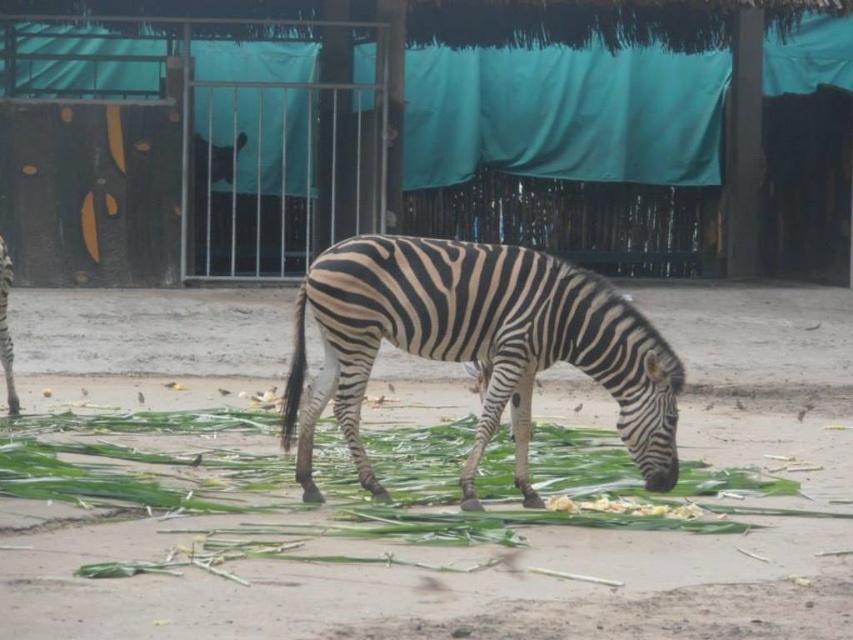
Question: Is green leafy grass at center smaller than black and white striped zebra at center?

Choices:
 (A) yes
 (B) no

Answer: (A)

Question: Which point is farther to the camera?

Choices:
 (A) (695, 477)
 (B) (375, 285)
 (C) (676, 509)

Answer: (A)

Question: Among these objects, which one is farthest from the camera?

Choices:
 (A) yellow crumbly food at lower center
 (B) green leafy grass at center
 (C) black and white striped zebra at center

Answer: (A)

Question: Based on their relative distances, which object is nearer to the green leafy grass at center?

Choices:
 (A) black and white striped zebra at center
 (B) yellow crumbly food at lower center

Answer: (A)

Question: Does black and white striped zebra at center come in front of yellow crumbly food at lower center?

Choices:
 (A) yes
 (B) no

Answer: (A)

Question: Is green leafy grass at center smaller than yellow crumbly food at lower center?

Choices:
 (A) yes
 (B) no

Answer: (B)